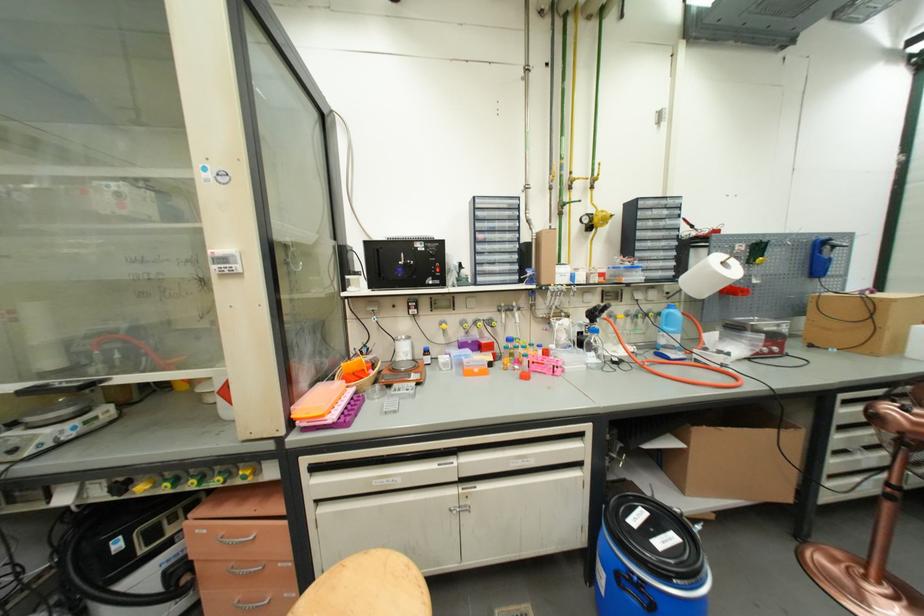
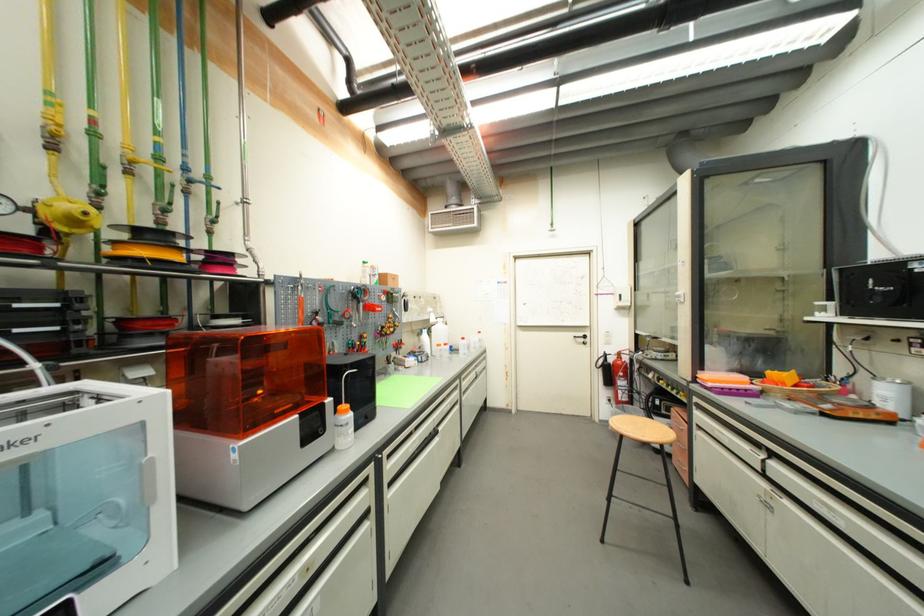
Question: I am providing you with two images of the same scene from different viewpoints. Which of the following objects are not visible in image2?

Choices:
 (A) fire extinguisher handle
 (B) black filament spool
 (C) metal drawer handle
 (D) none of these

Answer: (D)